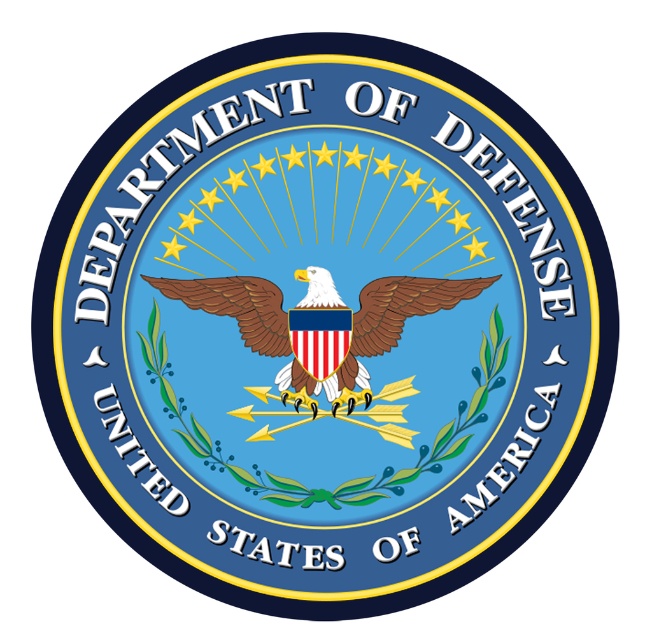
Question: Which point is closer to the camera?

Choices:
 (A) (209, 536)
 (B) (246, 342)

Answer: (B)

Question: Is brown matte eagle at center below blue matte text at lower right?

Choices:
 (A) yes
 (B) no

Answer: (B)

Question: Which of the following is the closest to the observer?

Choices:
 (A) blue glossy text at center
 (B) blue matte text at lower right
 (C) brown matte eagle at center

Answer: (C)

Question: Is brown matte eagle at center closer to camera compared to blue matte text at lower right?

Choices:
 (A) no
 (B) yes

Answer: (B)

Question: Does brown matte eagle at center come behind blue glossy text at center?

Choices:
 (A) yes
 (B) no

Answer: (B)

Question: Which object appears closest to the camera in this image?

Choices:
 (A) blue matte text at lower right
 (B) brown matte eagle at center

Answer: (B)